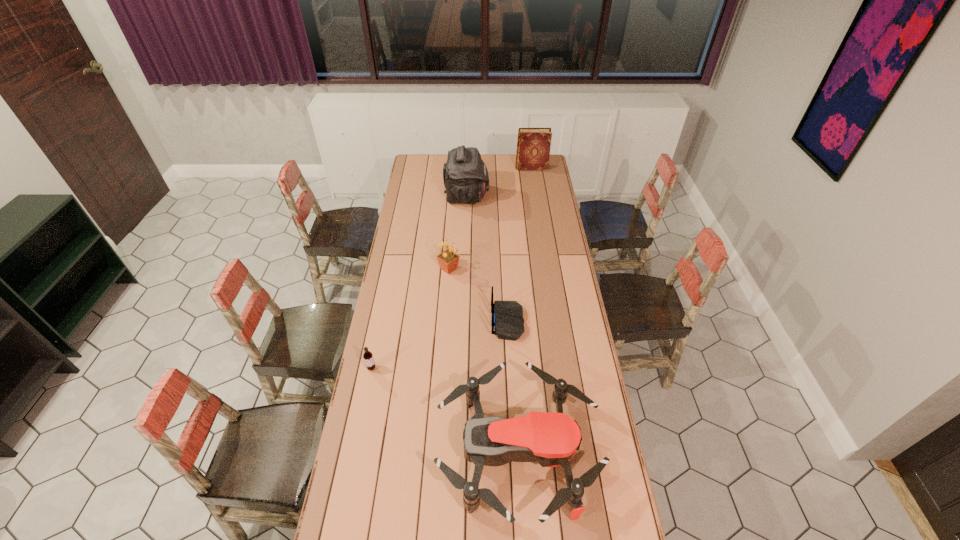
Identify the location of free space that satisfies the following two spatial constraints: 1. on the open flap of the tallest object; 2. at the front of the fourth shortest object with flowers visible. This screenshot has width=960, height=540. (464, 269).

Identify the location of free point that satisfies the following two spatial constraints: 1. on the spine side of the farthest object; 2. at the front of the third tallest object with flowers visible. (547, 269).